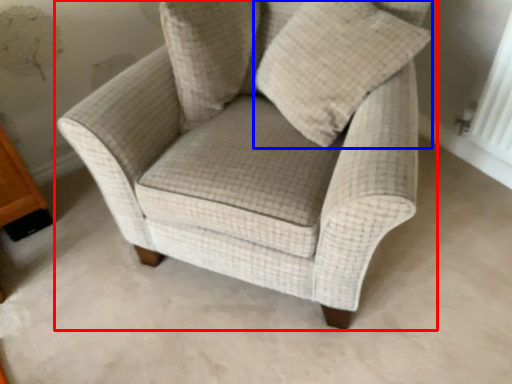
Question: Which point is further to the camera, chair (highlighted by a red box) or throw pillow (highlighted by a blue box)?

Choices:
 (A) chair
 (B) throw pillow

Answer: (B)